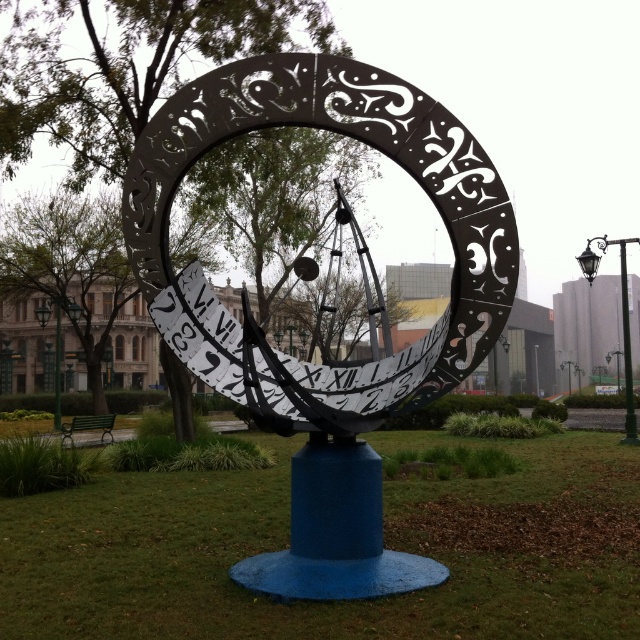
Does metallic blue sundial at center appear over black metal pole at right?

Actually, metallic blue sundial at center is below black metal pole at right.

Is metallic blue sundial at center to the left of black metal pole at right from the viewer's perspective?

Indeed, metallic blue sundial at center is positioned on the left side of black metal pole at right.

Is point (220, 512) farther from camera compared to point (625, 356)?

No.

This screenshot has width=640, height=640. I want to click on metallic blue sundial at center, so click(288, 541).

Between black metal clock at center and black metal pole at right, which one appears on the right side from the viewer's perspective?

Positioned to the right is black metal pole at right.

Is point (464, 163) behind point (627, 344)?

That is False.

Consider the image. Who is more distant from viewer, (413,170) or (625,346)?

Positioned behind is point (625,346).

This screenshot has width=640, height=640. Find the location of `black metal clock at center`. black metal clock at center is located at coordinates pos(305,362).

Based on the photo, can you confirm if metallic blue sundial at center is positioned below black metal clock at center?

Correct, metallic blue sundial at center is located below black metal clock at center.

Can you confirm if metallic blue sundial at center is thinner than black metal clock at center?

Incorrect, metallic blue sundial at center's width is not less than black metal clock at center's.

Is point (278, 497) closer to camera compared to point (168, 275)?

No, (278, 497) is behind (168, 275).

The image size is (640, 640). I want to click on metallic blue sundial at center, so click(288, 541).